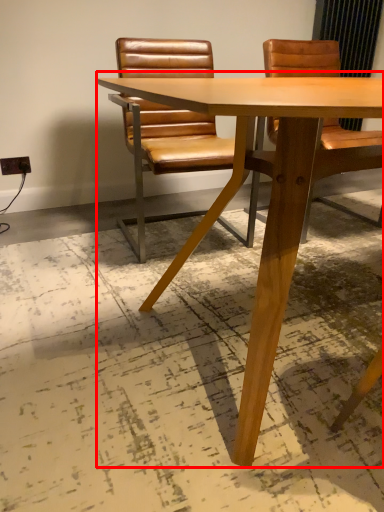
Question: From the image, what is the correct spatial relationship of table (annotated by the red box) in relation to chair?

Choices:
 (A) right
 (B) left

Answer: (A)